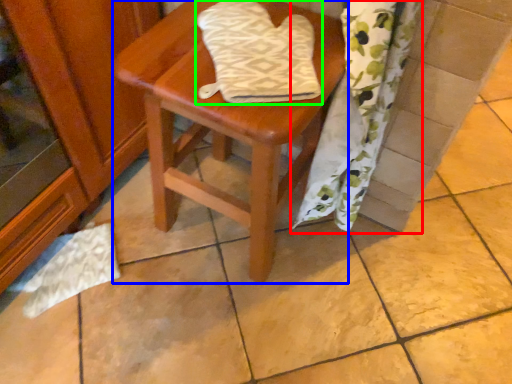
Question: Estimate the real-world distances between objects in this image. Which object is closer to curtain (highlighted by a red box), stool (highlighted by a blue box) or beach towel (highlighted by a green box)?

Choices:
 (A) stool
 (B) beach towel

Answer: (A)